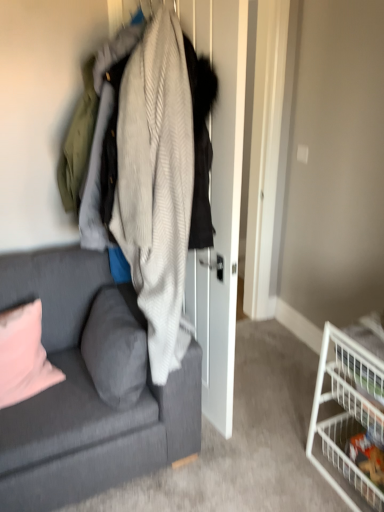
Question: Are white wire basket at lower right, which is counted as the 2th shelf, starting from the top, and gray fabric pillow at lower left, which appears as the first pillow when viewed from the right, beside each other?

Choices:
 (A) yes
 (B) no

Answer: (B)

Question: Is white wire basket at lower right, the first shelf in the bottom-to-top sequence, closer to the viewer compared to gray fabric pillow at lower left, which is the second pillow in left-to-right order?

Choices:
 (A) yes
 (B) no

Answer: (A)

Question: Is gray fabric pillow at lower left, which appears as the first pillow when viewed from the right, surrounded by white wire basket at lower right, which is counted as the 2th shelf, starting from the top?

Choices:
 (A) yes
 (B) no

Answer: (B)

Question: Considering the relative sizes of white wire basket at lower right, which is counted as the 2th shelf, starting from the top, and gray fabric pillow at lower left, which is the second pillow in left-to-right order, in the image provided, is white wire basket at lower right, which is counted as the 2th shelf, starting from the top, bigger than gray fabric pillow at lower left, which is the second pillow in left-to-right order,?

Choices:
 (A) yes
 (B) no

Answer: (B)

Question: From the image's perspective, is white wire basket at lower right, which is counted as the 2th shelf, starting from the top, located beneath gray fabric pillow at lower left, which is the second pillow in left-to-right order?

Choices:
 (A) yes
 (B) no

Answer: (A)

Question: From a real-world perspective, is white wire basket at lower right, which is counted as the 2th shelf, starting from the top, beneath gray fabric pillow at lower left, which is the second pillow in left-to-right order?

Choices:
 (A) yes
 (B) no

Answer: (A)

Question: From a real-world perspective, is white wire basket at lower right, the first shelf viewed from the top, over pink fabric pillow at lower left, arranged as the 1th pillow when viewed from the left?

Choices:
 (A) no
 (B) yes

Answer: (A)

Question: Is white wire basket at lower right, the second shelf from the bottom, aimed at pink fabric pillow at lower left, the second pillow from the right?

Choices:
 (A) no
 (B) yes

Answer: (A)

Question: Is white wire basket at lower right, the second shelf from the bottom, not within pink fabric pillow at lower left, arranged as the 1th pillow when viewed from the left?

Choices:
 (A) no
 (B) yes

Answer: (B)

Question: Can you confirm if white wire basket at lower right, the first shelf viewed from the top, is shorter than pink fabric pillow at lower left, the second pillow from the right?

Choices:
 (A) no
 (B) yes

Answer: (A)

Question: Is white wire basket at lower right, the first shelf viewed from the top, with pink fabric pillow at lower left, the second pillow from the right?

Choices:
 (A) yes
 (B) no

Answer: (B)

Question: Considering the relative sizes of white wire basket at lower right, the second shelf from the bottom, and pink fabric pillow at lower left, the second pillow from the right, in the image provided, is white wire basket at lower right, the second shelf from the bottom, bigger than pink fabric pillow at lower left, the second pillow from the right,?

Choices:
 (A) no
 (B) yes

Answer: (B)

Question: From the image's perspective, is textured gray couch at left beneath white wire basket at lower right, the first shelf viewed from the top?

Choices:
 (A) yes
 (B) no

Answer: (B)